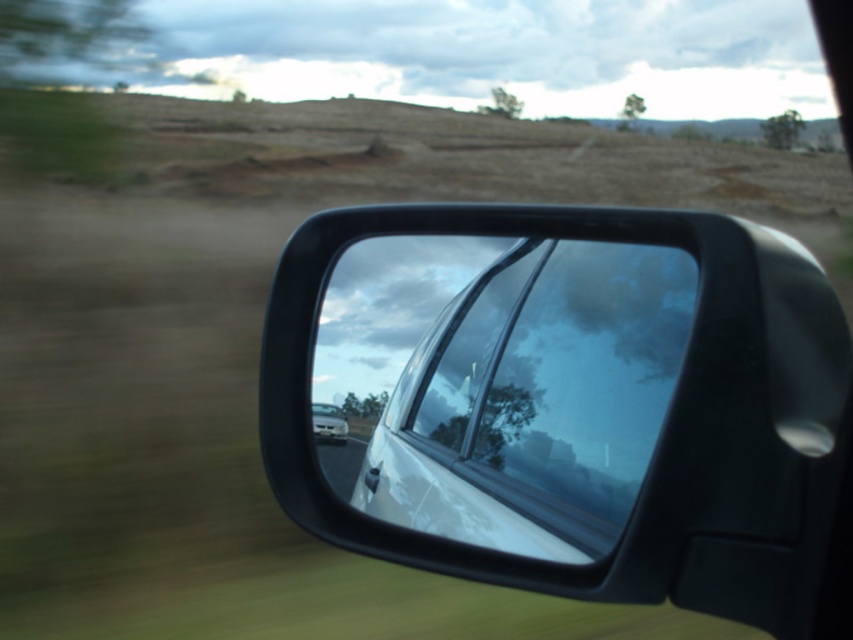
Describe the element at coordinates (570, 404) in the screenshot. I see `glossy black car mirror at right` at that location.

Does point (654, 337) lie behind point (486, 369)?

That is False.

At what (x,y) coordinates should I click in order to perform the action: click on glossy black car mirror at right. Please return your answer as a coordinate pair (x, y). The width and height of the screenshot is (853, 640). Looking at the image, I should click on 570,404.

Is clear glass car window at center closer to camera compared to white glossy car at center?

Yes, clear glass car window at center is closer to the viewer.

In order to click on clear glass car window at center in this screenshot , I will do `click(535, 401)`.

Can you confirm if glossy black car mirror at right is positioned to the left of white glossy car at center?

No, glossy black car mirror at right is not to the left of white glossy car at center.

In the scene shown: Is glossy black car mirror at right shorter than white glossy car at center?

No.

Who is more forward, (x=293, y=467) or (x=317, y=403)?

Point (x=293, y=467)

You are a GUI agent. You are given a task and a screenshot of the screen. Output one action in this format:
    pyautogui.click(x=<x>, y=<y>)
    Task: Click on the glossy black car mirror at right
    The image size is (853, 640).
    Given the screenshot: What is the action you would take?
    pyautogui.click(x=570, y=404)